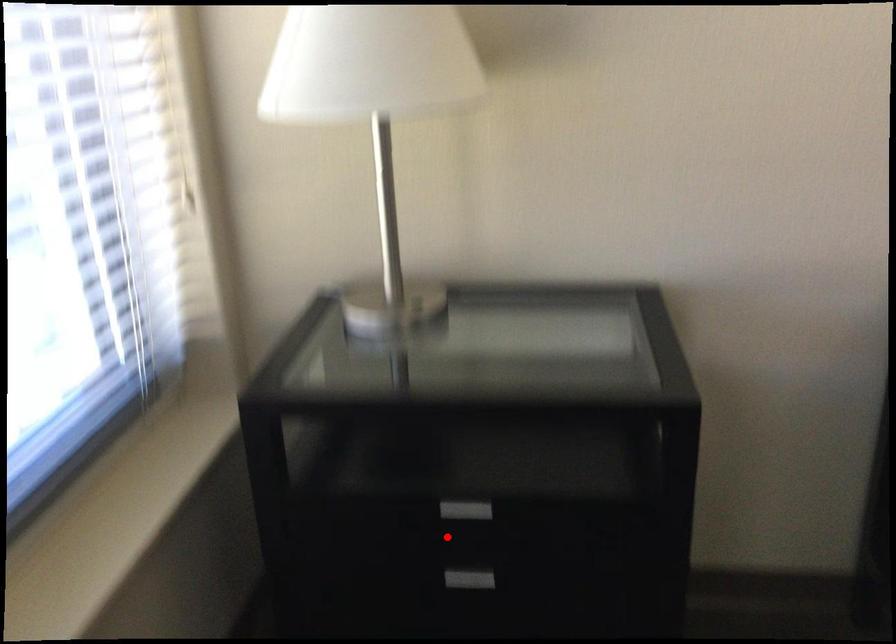
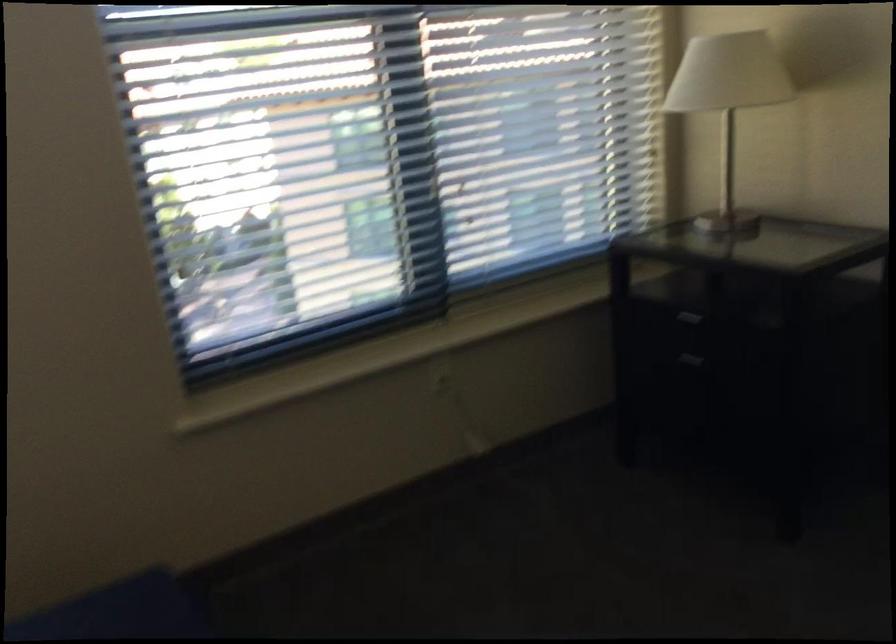
Where in the second image is the point corresponding to the highlighted location from the first image?

(685, 366)